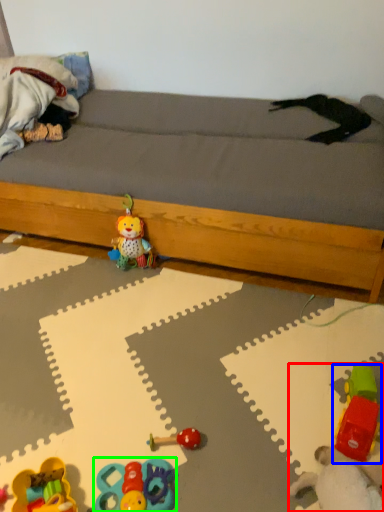
Question: Estimate the real-world distances between objects in this image. Which object is closer to toy (highlighted by a red box), toy (highlighted by a blue box) or toy (highlighted by a green box)?

Choices:
 (A) toy
 (B) toy

Answer: (A)